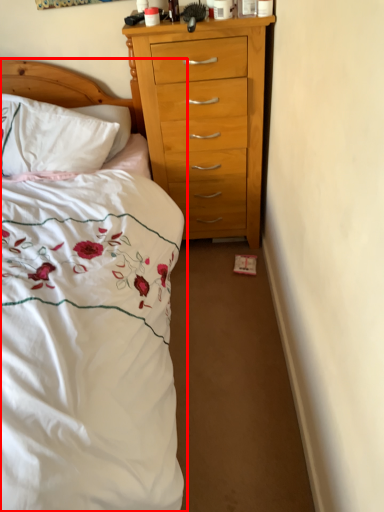
Question: From the image, what is the correct spatial relationship of bed (annotated by the red box) in relation to pillow?

Choices:
 (A) right
 (B) left

Answer: (A)